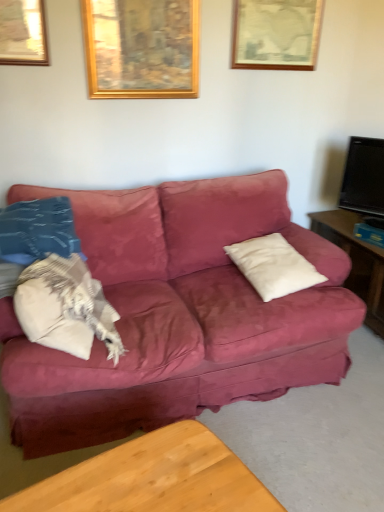
What do you see at coordinates (276, 34) in the screenshot?
I see `wooden framed picture at upper center, positioned as the second picture frame in left-to-right order` at bounding box center [276, 34].

At what (x,y) coordinates should I click in order to perform the action: click on gold wooden picture frame at upper center, which is counted as the first picture frame, starting from the left. Please return your answer as a coordinate pair (x, y). Looking at the image, I should click on (141, 48).

In order to face black glossy tv at right, should I rotate leftwards or rightwards?

You should look right and rotate roughly 22.402 degrees.

Image resolution: width=384 pixels, height=512 pixels. In order to click on white soft pillow at center, which is counted as the second pillow, starting from the left in this screenshot , I will do `click(273, 266)`.

Identify the location of wooden framed picture at upper center, placed as the first picture frame when sorted from right to left. The height and width of the screenshot is (512, 384). (276, 34).

Is gold wooden picture frame at upper center, arranged as the 2th picture frame when viewed from the right, not near wooden coffee table at lower center?

That's right, there is a large distance between gold wooden picture frame at upper center, arranged as the 2th picture frame when viewed from the right, and wooden coffee table at lower center.

Which object is more forward, gold wooden picture frame at upper center, arranged as the 2th picture frame when viewed from the right, or wooden coffee table at lower center?

wooden coffee table at lower center.

Considering the relative positions of gold wooden picture frame at upper center, which is counted as the first picture frame, starting from the left, and wooden coffee table at lower center in the image provided, is gold wooden picture frame at upper center, which is counted as the first picture frame, starting from the left, to the right of wooden coffee table at lower center from the viewer's perspective?

Incorrect, gold wooden picture frame at upper center, which is counted as the first picture frame, starting from the left, is not on the right side of wooden coffee table at lower center.

Is gold wooden picture frame at upper center, which is counted as the first picture frame, starting from the left, oriented towards wooden coffee table at lower center?

No, gold wooden picture frame at upper center, which is counted as the first picture frame, starting from the left, is not aimed at wooden coffee table at lower center.

From a real-world perspective, who is located lower, gold wooden picture frame at upper center, arranged as the 2th picture frame when viewed from the right, or black glossy tv at right?

In real-world perspective, black glossy tv at right is lower.

From the image's perspective, between gold wooden picture frame at upper center, arranged as the 2th picture frame when viewed from the right, and black glossy tv at right, which one is located above?

gold wooden picture frame at upper center, arranged as the 2th picture frame when viewed from the right, from the image's perspective.

Which of these two, gold wooden picture frame at upper center, arranged as the 2th picture frame when viewed from the right, or black glossy tv at right, is thinner?

gold wooden picture frame at upper center, arranged as the 2th picture frame when viewed from the right.

Who is shorter, gold wooden picture frame at upper center, arranged as the 2th picture frame when viewed from the right, or black glossy tv at right?

black glossy tv at right.

How different are the orientations of wooden framed picture at upper center, positioned as the second picture frame in left-to-right order, and white soft pillow at left, the second pillow viewed from the right, in degrees?

The angle between the facing direction of wooden framed picture at upper center, positioned as the second picture frame in left-to-right order, and the facing direction of white soft pillow at left, the second pillow viewed from the right, is 2.25 degrees.

From a real-world perspective, is wooden framed picture at upper center, positioned as the second picture frame in left-to-right order, positioned under white soft pillow at left, which is counted as the first pillow, starting from the left, based on gravity?

No, from a real-world perspective, wooden framed picture at upper center, positioned as the second picture frame in left-to-right order, is not beneath white soft pillow at left, which is counted as the first pillow, starting from the left.

From the image's perspective, is wooden framed picture at upper center, positioned as the second picture frame in left-to-right order, positioned above or below white soft pillow at left, the second pillow viewed from the right?

Based on their image positions, wooden framed picture at upper center, positioned as the second picture frame in left-to-right order, is located above white soft pillow at left, the second pillow viewed from the right.

The image size is (384, 512). Identify the location of the 1st pillow below the wooden framed picture at upper center, placed as the first picture frame when sorted from right to left (from a real-world perspective). (68, 307).

Is wooden coffee table at lower center in front of or behind black glossy tv at right in the image?

In the image, wooden coffee table at lower center appears in front of black glossy tv at right.

Between wooden coffee table at lower center and black glossy tv at right, which one has less height?

Standing shorter between the two is wooden coffee table at lower center.

Can you tell me how much wooden coffee table at lower center and black glossy tv at right differ in facing direction?

The angle between the facing direction of wooden coffee table at lower center and the facing direction of black glossy tv at right is 68.1 degrees.

From the image's perspective, which one is positioned higher, wooden coffee table at lower center or black glossy tv at right?

black glossy tv at right is shown above in the image.

Image resolution: width=384 pixels, height=512 pixels. What are the coordinates of `table below the wooden framed picture at upper center, placed as the first picture frame when sorted from right to left (from the image's perspective)` in the screenshot? It's located at (153, 478).

Considering the positions of objects wooden coffee table at lower center and wooden framed picture at upper center, placed as the first picture frame when sorted from right to left, in the image provided, who is in front, wooden coffee table at lower center or wooden framed picture at upper center, placed as the first picture frame when sorted from right to left,?

Positioned in front is wooden coffee table at lower center.

Are wooden coffee table at lower center and wooden framed picture at upper center, positioned as the second picture frame in left-to-right order, beside each other?

There is a gap between wooden coffee table at lower center and wooden framed picture at upper center, positioned as the second picture frame in left-to-right order.

Considering the positions of objects wooden coffee table at lower center and wooden framed picture at upper center, placed as the first picture frame when sorted from right to left, in the image provided, who is more to the left, wooden coffee table at lower center or wooden framed picture at upper center, placed as the first picture frame when sorted from right to left,?

wooden coffee table at lower center is more to the left.

Which point is more distant from viewer, (342, 196) or (84, 23)?

The point (342, 196) is behind.

Is black glossy tv at right thinner than gold wooden picture frame at upper center, which is counted as the first picture frame, starting from the left?

Incorrect, the width of black glossy tv at right is not less than that of gold wooden picture frame at upper center, which is counted as the first picture frame, starting from the left.

Can you tell me how much black glossy tv at right and gold wooden picture frame at upper center, which is counted as the first picture frame, starting from the left, differ in facing direction?

54.3 degrees.

Who is smaller, wooden framed picture at upper center, positioned as the second picture frame in left-to-right order, or gold wooden picture frame at upper center, which is counted as the first picture frame, starting from the left?

Smaller between the two is wooden framed picture at upper center, positioned as the second picture frame in left-to-right order.

From a real-world perspective, who is located lower, wooden framed picture at upper center, placed as the first picture frame when sorted from right to left, or gold wooden picture frame at upper center, arranged as the 2th picture frame when viewed from the right?

In real-world perspective, gold wooden picture frame at upper center, arranged as the 2th picture frame when viewed from the right, is lower.

At what (x,y) coordinates should I click in order to perform the action: click on picture frame on the left of wooden framed picture at upper center, placed as the first picture frame when sorted from right to left. Please return your answer as a coordinate pair (x, y). Looking at the image, I should click on (141, 48).

Is wooden framed picture at upper center, placed as the first picture frame when sorted from right to left, positioned in front of gold wooden picture frame at upper center, arranged as the 2th picture frame when viewed from the right?

No, it is behind gold wooden picture frame at upper center, arranged as the 2th picture frame when viewed from the right.

Locate an element on the screen. Image resolution: width=384 pixels, height=512 pixels. table that appears below the gold wooden picture frame at upper center, which is counted as the first picture frame, starting from the left (from a real-world perspective) is located at coordinates (153, 478).

The width and height of the screenshot is (384, 512). I want to click on television lying on the right of gold wooden picture frame at upper center, arranged as the 2th picture frame when viewed from the right, so click(x=364, y=177).

Based on their spatial positions, is white soft pillow at left, which is counted as the first pillow, starting from the left, or white soft pillow at center, which is counted as the second pillow, starting from the left, closer to gold wooden picture frame at upper center, arranged as the 2th picture frame when viewed from the right?

white soft pillow at center, which is counted as the second pillow, starting from the left, is closer to gold wooden picture frame at upper center, arranged as the 2th picture frame when viewed from the right.

Which object lies nearer to the anchor point gold wooden picture frame at upper center, arranged as the 2th picture frame when viewed from the right, wooden coffee table at lower center or black glossy tv at right?

black glossy tv at right lies closer to gold wooden picture frame at upper center, arranged as the 2th picture frame when viewed from the right, than the other object.

Based on their spatial positions, is white soft pillow at left, which is counted as the first pillow, starting from the left, or wooden framed picture at upper center, placed as the first picture frame when sorted from right to left, further from black glossy tv at right?

white soft pillow at left, which is counted as the first pillow, starting from the left, lies further to black glossy tv at right than the other object.

Considering their positions, is wooden framed picture at upper center, placed as the first picture frame when sorted from right to left, positioned further to gold wooden picture frame at upper center, arranged as the 2th picture frame when viewed from the right, than black glossy tv at right?

Based on the image, black glossy tv at right appears to be further to gold wooden picture frame at upper center, arranged as the 2th picture frame when viewed from the right.

Looking at the image, which one is located further to wooden framed picture at upper center, placed as the first picture frame when sorted from right to left, white soft pillow at left, the second pillow viewed from the right, or wooden coffee table at lower center?

wooden coffee table at lower center.

When comparing their distances from wooden framed picture at upper center, placed as the first picture frame when sorted from right to left, does wooden coffee table at lower center or white soft pillow at center, which appears as the first pillow when viewed from the right, seem closer?

Among the two, white soft pillow at center, which appears as the first pillow when viewed from the right, is located nearer to wooden framed picture at upper center, placed as the first picture frame when sorted from right to left.

Looking at the image, which one is located further to white soft pillow at center, which appears as the first pillow when viewed from the right, black glossy tv at right or gold wooden picture frame at upper center, arranged as the 2th picture frame when viewed from the right?

gold wooden picture frame at upper center, arranged as the 2th picture frame when viewed from the right, is further to white soft pillow at center, which appears as the first pillow when viewed from the right.

Considering their positions, is wooden framed picture at upper center, positioned as the second picture frame in left-to-right order, positioned closer to white soft pillow at left, which is counted as the first pillow, starting from the left, than gold wooden picture frame at upper center, arranged as the 2th picture frame when viewed from the right?

gold wooden picture frame at upper center, arranged as the 2th picture frame when viewed from the right, is closer to white soft pillow at left, which is counted as the first pillow, starting from the left.

Locate an element on the screen. The image size is (384, 512). picture frame between wooden framed picture at upper center, positioned as the second picture frame in left-to-right order, and white soft pillow at center, which appears as the first pillow when viewed from the right, in the vertical direction is located at coordinates (141, 48).

Identify the location of television between wooden framed picture at upper center, positioned as the second picture frame in left-to-right order, and white soft pillow at center, which is counted as the second pillow, starting from the left, vertically. This screenshot has height=512, width=384. (364, 177).

At what (x,y) coordinates should I click in order to perform the action: click on pillow between gold wooden picture frame at upper center, arranged as the 2th picture frame when viewed from the right, and black glossy tv at right from left to right. Please return your answer as a coordinate pair (x, y). This screenshot has height=512, width=384. Looking at the image, I should click on (273, 266).

Locate an element on the screen. This screenshot has width=384, height=512. pillow between wooden coffee table at lower center and white soft pillow at center, which appears as the first pillow when viewed from the right, from front to back is located at coordinates pos(68,307).